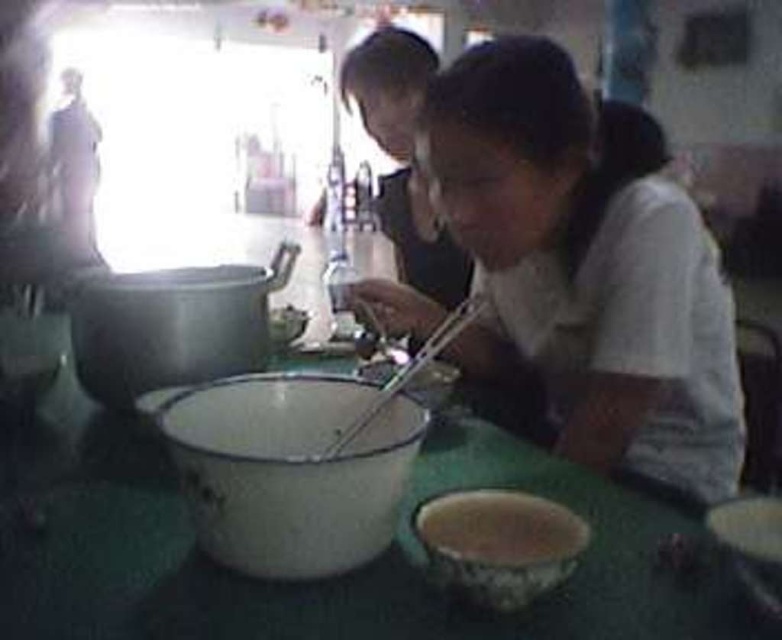
You are setting up a buffet table and need to arrange two bowls. The white enamel mixing bowl at center and the matte white mixing bowl at center must be placed in a specific order based on their positions. Which bowl should you place higher up on the table to match the image?

The matte white mixing bowl at center should be placed higher up on the table since the white enamel mixing bowl at center is positioned below it in the image.

You are a guest at a dinner party and need to reach the metallic silver chopsticks at center to serve yourself. The white matte shirt at center is blocking your view. Can you move the shirt to access the chopsticks?

The white matte shirt at center is further to the viewer than metallic silver chopsticks at center, so you can move the shirt to access the chopsticks since the chopsticks are behind the shirt.

You are standing in the kitchen and want to reach both points on the table. Which point, point (364, 547) or point (207, 280), is closer to you?

Point (364, 547) is closer to the viewer than point (207, 280), so you would reach that one first.